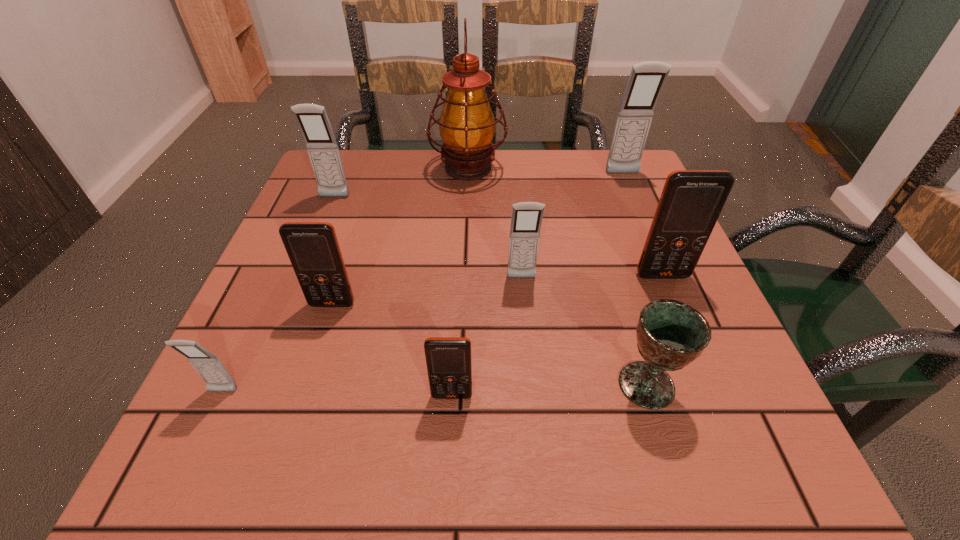
Where is `vacant position located on the screen of the second nearest orange cellular telephone`? This screenshot has height=540, width=960. vacant position located on the screen of the second nearest orange cellular telephone is located at coordinates click(x=289, y=441).

Locate an element on the screen. The image size is (960, 540). free location located 0.350m on the left of the chalice is located at coordinates (385, 385).

Locate an element on the screen. This screenshot has width=960, height=540. vacant space situated on the screen of the fourth cellular telephone from right to left is located at coordinates (449, 454).

Where is `vacant region located on the front-facing side of the smallest gray cellular telephone`? This screenshot has width=960, height=540. vacant region located on the front-facing side of the smallest gray cellular telephone is located at coordinates (192, 457).

Where is `oil lamp situated at the far edge`? The width and height of the screenshot is (960, 540). oil lamp situated at the far edge is located at coordinates (467, 125).

Find the location of a particular element. Image resolution: width=960 pixels, height=540 pixels. chalice located at the right edge is located at coordinates pos(670,334).

Identify the location of object that is at the far left corner. The image size is (960, 540). (312, 119).

At what (x,y) coordinates should I click in order to perform the action: click on object at the far right corner. Please return your answer as a coordinate pair (x, y). The image size is (960, 540). Looking at the image, I should click on (647, 79).

What are the coordinates of `free region at the far edge` in the screenshot? It's located at (395, 167).

What are the coordinates of `free space at the near edge of the desktop` in the screenshot? It's located at (460, 421).